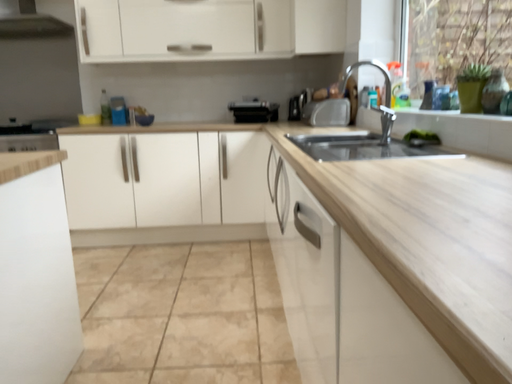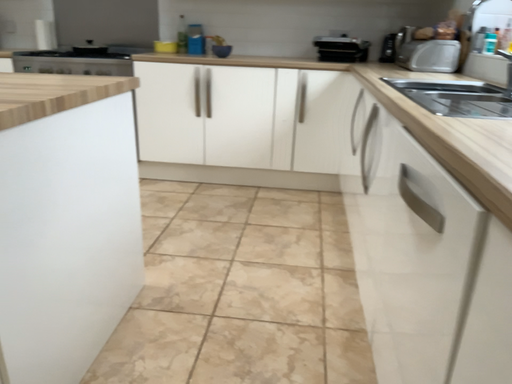
Question: Which way did the camera rotate in the video?

Choices:
 (A) rotated right
 (B) rotated left

Answer: (B)